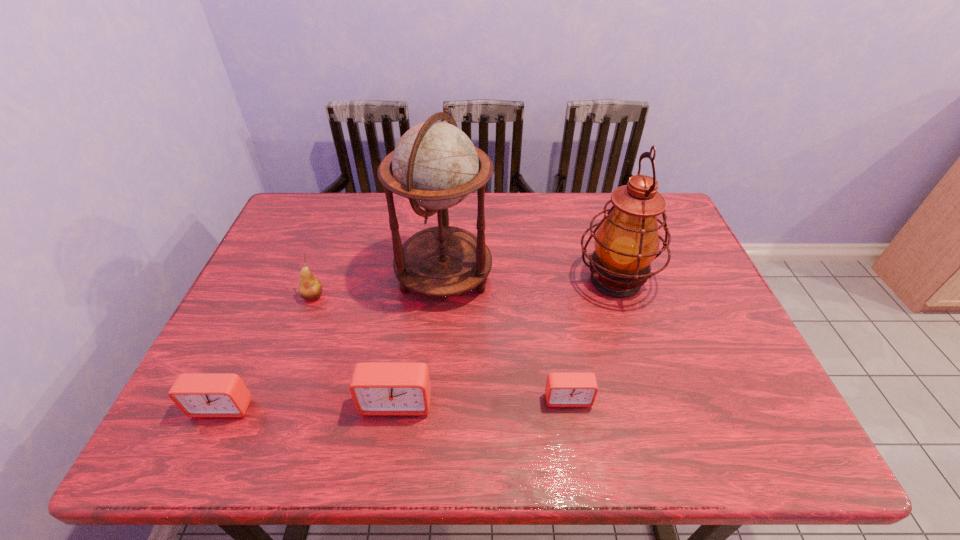
Where is `vacant space at the near left corner of the desktop`? The width and height of the screenshot is (960, 540). vacant space at the near left corner of the desktop is located at coordinates (252, 389).

In the image, there is a desktop. Where is `free space at the far right corner`? The image size is (960, 540). free space at the far right corner is located at coordinates (678, 230).

At what (x,y) coordinates should I click in order to perform the action: click on free space at the near right corner. Please return your answer as a coordinate pair (x, y). The image size is (960, 540). Looking at the image, I should click on (749, 397).

This screenshot has height=540, width=960. I want to click on empty location between the second shortest alarm clock and the globe, so click(333, 341).

In order to click on free spot between the globe and the rightmost object in this screenshot , I will do `click(530, 278)`.

At what (x,y) coordinates should I click in order to perform the action: click on vacant area that lies between the pear and the second alarm clock from left to right. Please return your answer as a coordinate pair (x, y). Looking at the image, I should click on (355, 349).

Where is `unoccupied area between the fifth object from right to left and the globe`? unoccupied area between the fifth object from right to left and the globe is located at coordinates (378, 286).

Where is `free spot between the rightmost object and the globe`? free spot between the rightmost object and the globe is located at coordinates (530, 278).

Image resolution: width=960 pixels, height=540 pixels. I want to click on free space between the fifth object from right to left and the second alarm clock from right to left, so click(355, 349).

This screenshot has height=540, width=960. In order to click on empty space between the fifth tallest object and the pear in this screenshot , I will do `click(268, 352)`.